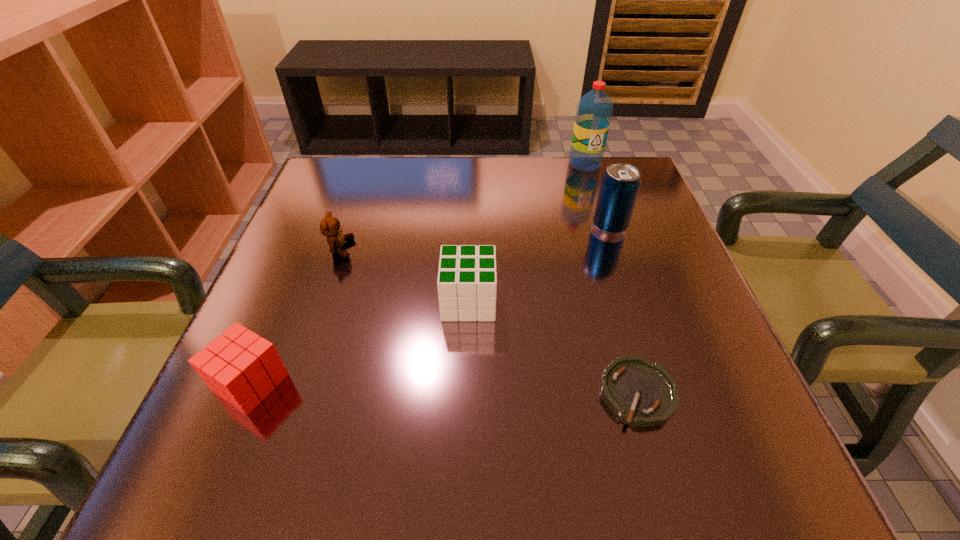
Where is `free space at the far right corner`? free space at the far right corner is located at coordinates (650, 189).

The width and height of the screenshot is (960, 540). I want to click on unoccupied position between the right cube and the teddy bear, so click(x=404, y=275).

Locate an element on the screen. Image resolution: width=960 pixels, height=540 pixels. empty location between the left cube and the third object from left to right is located at coordinates (360, 342).

Identify the location of free space between the water bottle and the teddy bear. (463, 206).

Identify the location of free space between the water bottle and the shortest object. (612, 279).

I want to click on vacant region between the water bottle and the shorter cube, so point(418,274).

At what (x,y) coordinates should I click in order to perform the action: click on free space that is in between the third object from left to right and the water bottle. Please return your answer as a coordinate pair (x, y). Image resolution: width=960 pixels, height=540 pixels. Looking at the image, I should click on (527, 233).

You are a GUI agent. You are given a task and a screenshot of the screen. Output one action in this format:
    pyautogui.click(x=<x>, y=<y>)
    Task: Click on the unoccupied position between the shortest object and the left cube
    
    Given the screenshot: What is the action you would take?
    pyautogui.click(x=444, y=388)

At what (x,y) coordinates should I click in order to perform the action: click on vacant point located between the tallest object and the soda can. Please return your answer as a coordinate pair (x, y). The image size is (960, 540). Looking at the image, I should click on (597, 195).

The height and width of the screenshot is (540, 960). Find the location of `free point between the soda can and the farther cube`. free point between the soda can and the farther cube is located at coordinates (540, 264).